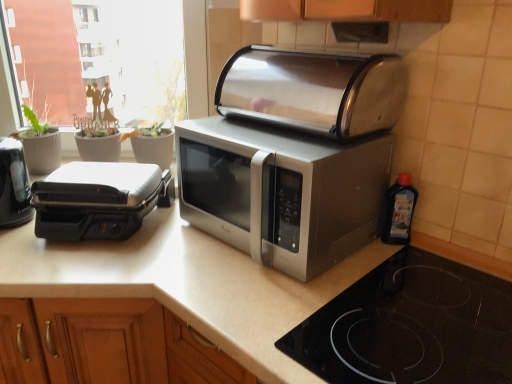
Question: Considering the relative sizes of black plastic toaster at left, marked as the 1th toaster in a left-to-right arrangement, and transparent plastic window screen at upper left in the image provided, is black plastic toaster at left, marked as the 1th toaster in a left-to-right arrangement, taller than transparent plastic window screen at upper left?

Choices:
 (A) no
 (B) yes

Answer: (A)

Question: Does black plastic toaster at left, marked as the 1th toaster in a left-to-right arrangement, appear on the left side of transparent plastic window screen at upper left?

Choices:
 (A) no
 (B) yes

Answer: (B)

Question: From the image's perspective, is black plastic toaster at left, marked as the 1th toaster in a left-to-right arrangement, located beneath transparent plastic window screen at upper left?

Choices:
 (A) yes
 (B) no

Answer: (A)

Question: Does black plastic toaster at left, which ranks as the 3th toaster in right-to-left order, have a lesser height compared to transparent plastic window screen at upper left?

Choices:
 (A) no
 (B) yes

Answer: (B)

Question: Considering the relative sizes of black plastic toaster at left, which ranks as the 3th toaster in right-to-left order, and transparent plastic window screen at upper left in the image provided, is black plastic toaster at left, which ranks as the 3th toaster in right-to-left order, wider than transparent plastic window screen at upper left?

Choices:
 (A) no
 (B) yes

Answer: (B)

Question: Is black plastic toaster at left, marked as the 1th toaster in a left-to-right arrangement, smaller than transparent plastic window screen at upper left?

Choices:
 (A) no
 (B) yes

Answer: (B)

Question: From a real-world perspective, does satin silver microwave at center stand above transparent plastic window screen at upper left?

Choices:
 (A) yes
 (B) no

Answer: (B)

Question: Does satin silver microwave at center lie in front of transparent plastic window screen at upper left?

Choices:
 (A) yes
 (B) no

Answer: (A)

Question: Can you confirm if satin silver microwave at center is positioned to the left of transparent plastic window screen at upper left?

Choices:
 (A) yes
 (B) no

Answer: (B)

Question: Are satin silver microwave at center and transparent plastic window screen at upper left located far from each other?

Choices:
 (A) yes
 (B) no

Answer: (A)

Question: Is satin silver microwave at center oriented towards transparent plastic window screen at upper left?

Choices:
 (A) no
 (B) yes

Answer: (A)

Question: Is satin silver microwave at center with transparent plastic window screen at upper left?

Choices:
 (A) yes
 (B) no

Answer: (B)

Question: Is black plastic toaster at left, which ranks as the 3th toaster in right-to-left order, taller than stainless steel toaster at center, the 3th toaster viewed from the left?

Choices:
 (A) no
 (B) yes

Answer: (B)